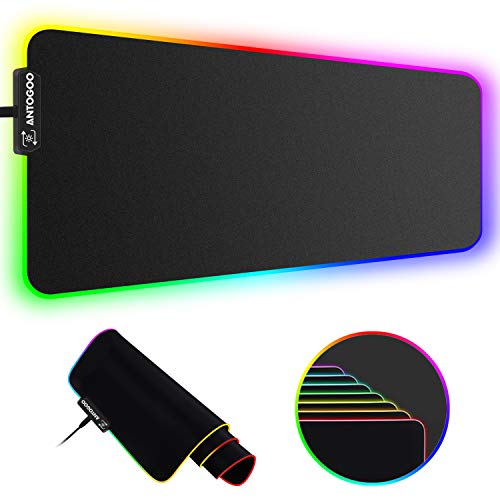
Where is `kind of mat`? kind of mat is located at coordinates (222, 197).